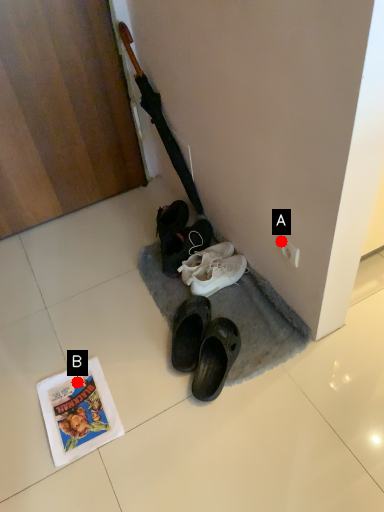
Question: Two points are circled on the image, labeled by A and B beside each circle. Among these points, which one is nearest to the camera?

Choices:
 (A) A is closer
 (B) B is closer

Answer: (A)